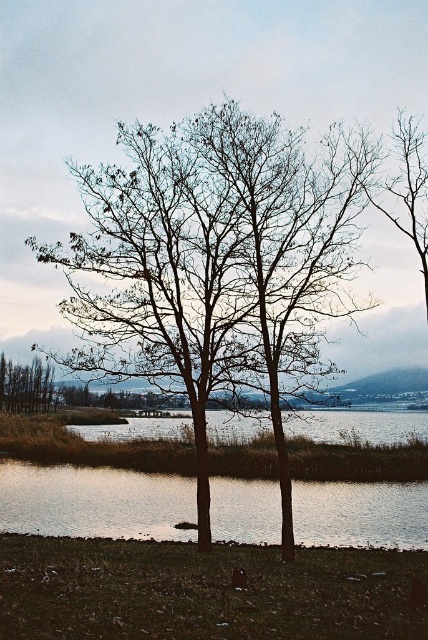
Question: Can you confirm if bare branches at center is bigger than brown matte tree at left?

Choices:
 (A) no
 (B) yes

Answer: (B)

Question: Does bare branches at center appear on the right side of brown matte tree at left?

Choices:
 (A) no
 (B) yes

Answer: (B)

Question: Based on their relative distances, which object is farther from the reflective glass water at center?

Choices:
 (A) bare branches at center
 (B) brown matte tree at left

Answer: (B)

Question: Which point is closer to the camera taking this photo?

Choices:
 (A) (258, 177)
 (B) (149, 520)
 (C) (48, 365)

Answer: (A)

Question: Which object appears closest to the camera in this image?

Choices:
 (A) bare branches at center
 (B) brown matte tree at left
 (C) reflective glass water at center

Answer: (A)

Question: Does reflective glass water at center appear on the right side of brown matte tree at left?

Choices:
 (A) no
 (B) yes

Answer: (B)